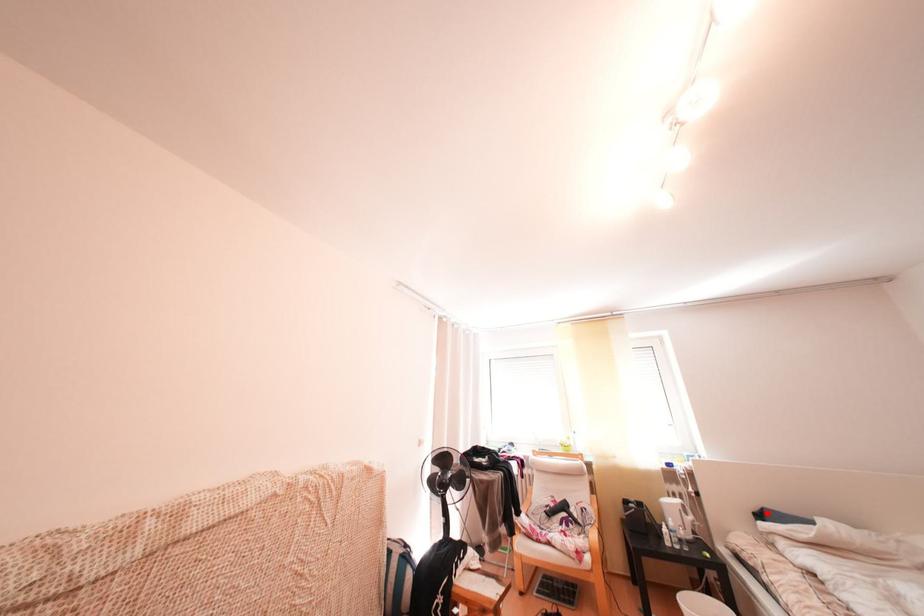
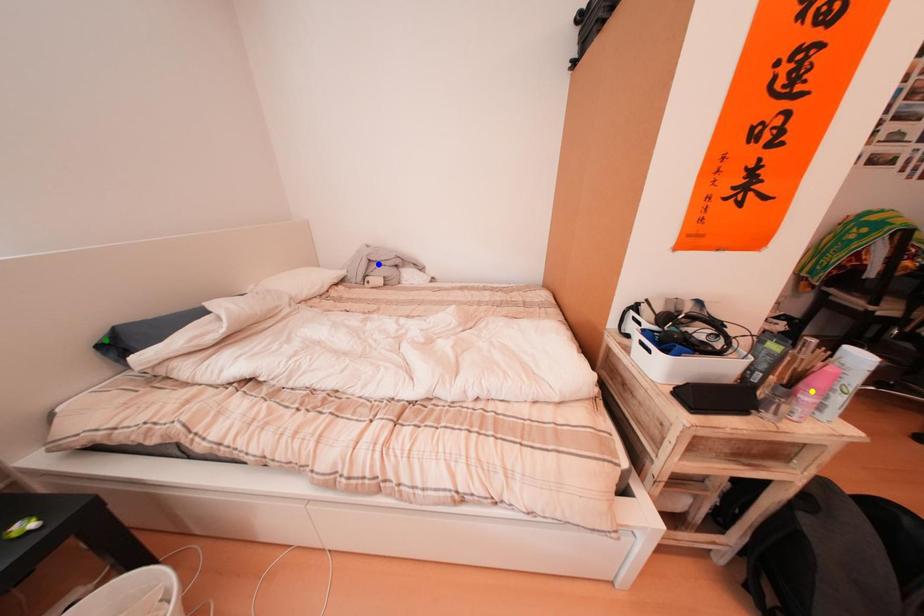
Question: I am providing you with two images of the same scene from different viewpoints. A red point is marked on the first image. You are given multiple points on the second image. Which mark in image 2 goes with the point in image 1?

Choices:
 (A) green point
 (B) yellow point
 (C) blue point

Answer: (A)